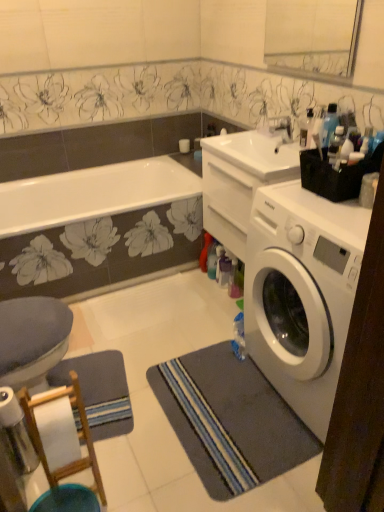
Question: Does transparent plastic bottle at upper right, marked as the 2th bottle in a bottom-to-top arrangement, have a lesser width compared to white glossy sink at upper center?

Choices:
 (A) no
 (B) yes

Answer: (B)

Question: Are transparent plastic bottle at upper right, which is counted as the first bottle, starting from the back, and white glossy sink at upper center making contact?

Choices:
 (A) no
 (B) yes

Answer: (A)

Question: From the image's perspective, is transparent plastic bottle at upper right, the first bottle from the top, under white glossy sink at upper center?

Choices:
 (A) yes
 (B) no

Answer: (B)

Question: Could white glossy sink at upper center be considered to be inside transparent plastic bottle at upper right, the 2th bottle positioned from the front?

Choices:
 (A) yes
 (B) no

Answer: (B)

Question: Does transparent plastic bottle at upper right, which is counted as the first bottle, starting from the back, have a lesser height compared to white glossy sink at upper center?

Choices:
 (A) yes
 (B) no

Answer: (B)

Question: Is blue fabric toilet at lower left situated inside white glossy sink at upper center or outside?

Choices:
 (A) inside
 (B) outside

Answer: (B)

Question: Considering the relative positions of blue fabric toilet at lower left and white glossy sink at upper center in the image provided, is blue fabric toilet at lower left to the left or to the right of white glossy sink at upper center?

Choices:
 (A) right
 (B) left

Answer: (B)

Question: Is blue fabric toilet at lower left in front of or behind white glossy sink at upper center in the image?

Choices:
 (A) front
 (B) behind

Answer: (A)

Question: From a real-world perspective, is blue fabric toilet at lower left positioned above or below white glossy sink at upper center?

Choices:
 (A) below
 (B) above

Answer: (A)

Question: Is white glossy faucet at upper center spatially inside blue striped yoga mat at lower left, or outside of it?

Choices:
 (A) inside
 (B) outside

Answer: (B)

Question: Is white glossy faucet at upper center in front of or behind blue striped yoga mat at lower left in the image?

Choices:
 (A) behind
 (B) front

Answer: (A)

Question: In terms of width, does white glossy faucet at upper center look wider or thinner when compared to blue striped yoga mat at lower left?

Choices:
 (A) wide
 (B) thin

Answer: (B)

Question: Is point (273, 130) positioned closer to the camera than point (94, 397)?

Choices:
 (A) farther
 (B) closer

Answer: (A)

Question: In the image, is clear glass mirror at upper center on the left side or the right side of transparent plastic bottle at upper right, the first bottle from the top?

Choices:
 (A) right
 (B) left

Answer: (B)

Question: Considering the positions of clear glass mirror at upper center and transparent plastic bottle at upper right, which is counted as the first bottle, starting from the back, in the image, is clear glass mirror at upper center taller or shorter than transparent plastic bottle at upper right, which is counted as the first bottle, starting from the back,?

Choices:
 (A) tall
 (B) short

Answer: (A)